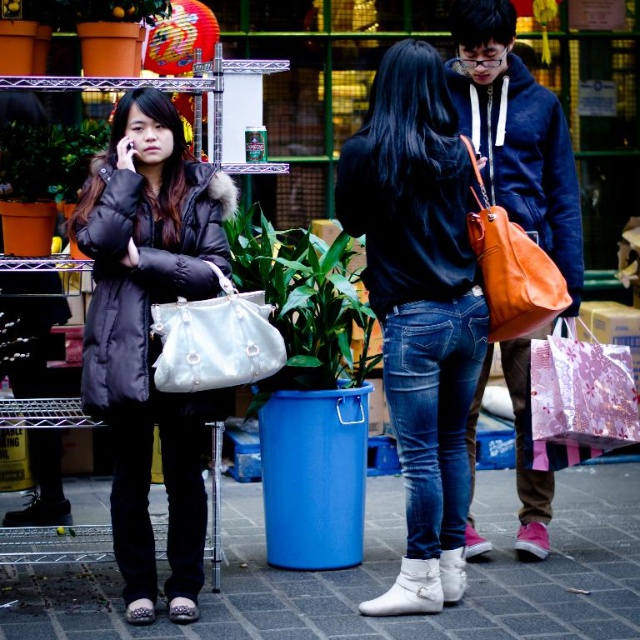
Who is more distant from viewer, (438, 595) or (292, 285)?

Positioned behind is point (292, 285).

Does matte black jacket at center lie in front of blue plastic pot at center?

Yes, it is in front of blue plastic pot at center.

I want to click on matte black jacket at center, so click(x=419, y=307).

Does white tile pavement at lower center appear over matte black coat at left?

No, white tile pavement at lower center is not above matte black coat at left.

Is point (600, 608) closer to viewer compared to point (170, 193)?

That is True.

You are a GUI agent. You are given a task and a screenshot of the screen. Output one action in this format:
    pyautogui.click(x=<x>, y=<y>)
    Task: Click on the white tile pavement at lower center
    This screenshot has height=640, width=640.
    Given the screenshot: What is the action you would take?
    pyautogui.click(x=381, y=577)

Is white tile pavement at lower center wider than white leather handbag at center?

Correct, the width of white tile pavement at lower center exceeds that of white leather handbag at center.

Is point (221, 593) closer to camera compared to point (241, 337)?

That is False.

Locate an element on the screen. This screenshot has width=640, height=640. white tile pavement at lower center is located at coordinates (381, 577).